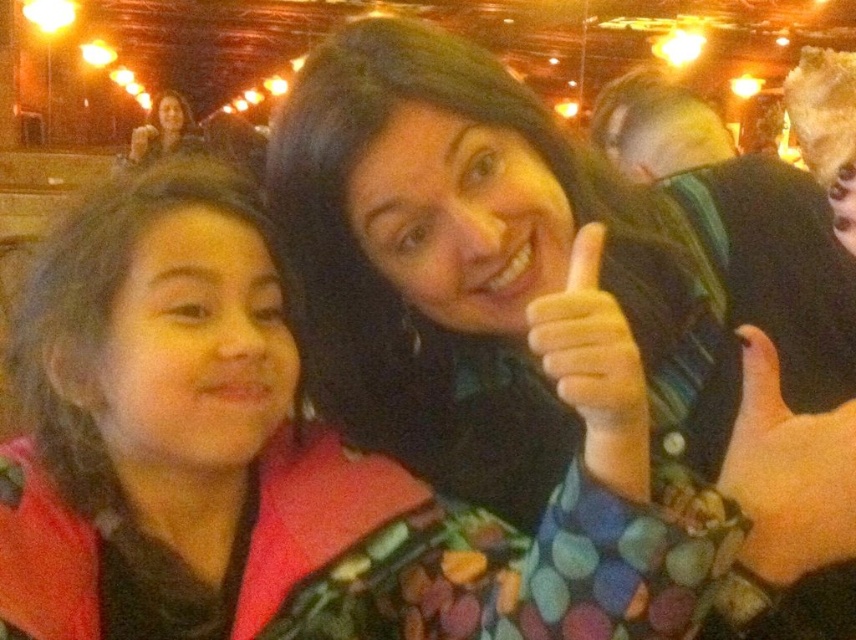
Question: Which is nearer to the pink matte hand at upper right?

Choices:
 (A) matte black hair at upper left
 (B) matte black hand at upper center
 (C) green striped sweater at upper right

Answer: (B)

Question: Is green striped sweater at upper right positioned behind matte black hand at upper center?

Choices:
 (A) yes
 (B) no

Answer: (A)

Question: Which object is positioned closest to the matte black hair at upper left?

Choices:
 (A) pink matte hand at upper right
 (B) matte black hand at upper center
 (C) green striped sweater at upper right

Answer: (C)

Question: Can you confirm if pink matte hand at upper right is positioned above matte black hair at upper left?

Choices:
 (A) no
 (B) yes

Answer: (A)

Question: Is pink matte hand at upper right to the left of matte black hair at upper left from the viewer's perspective?

Choices:
 (A) yes
 (B) no

Answer: (B)

Question: Among these objects, which one is nearest to the camera?

Choices:
 (A) matte black hair at upper left
 (B) matte black hand at upper center

Answer: (B)